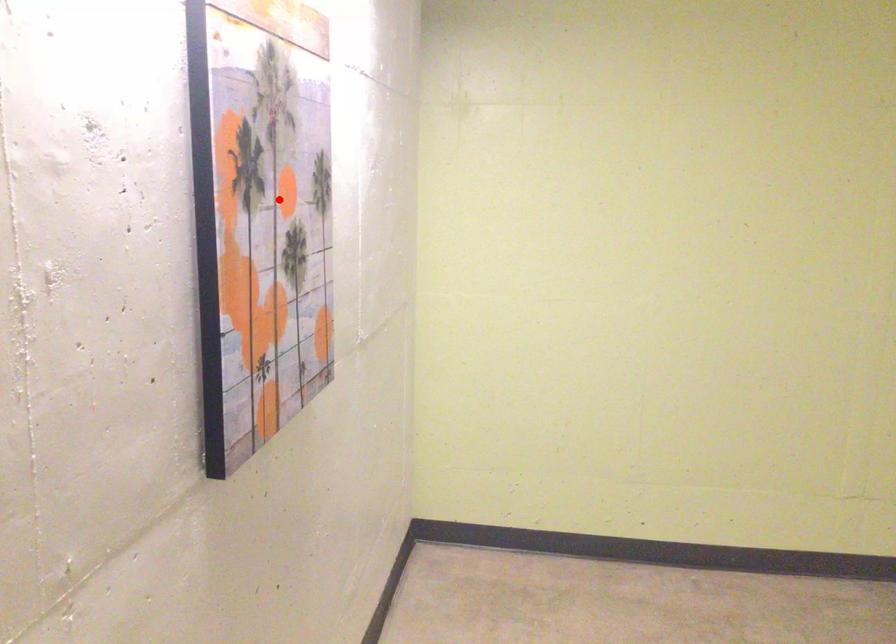
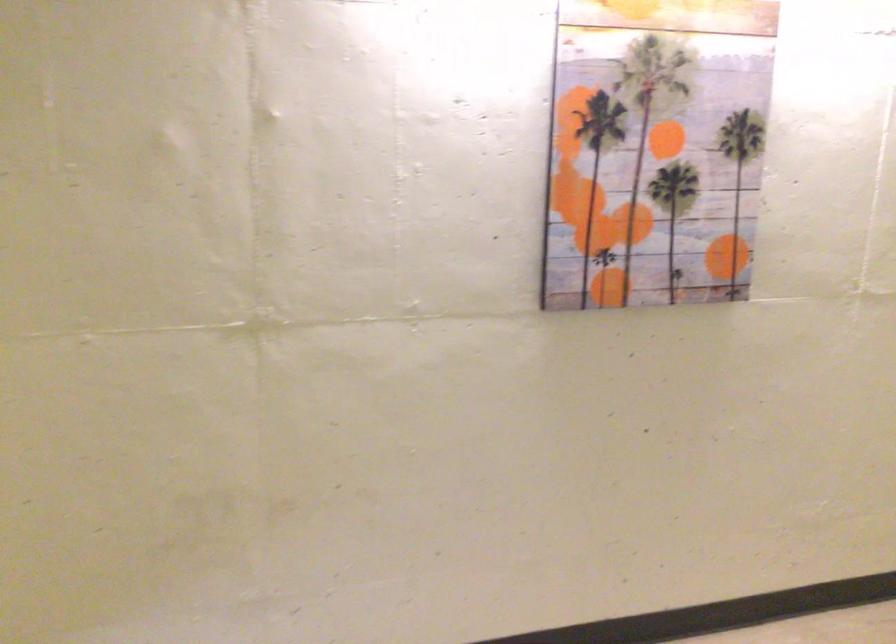
Question: I am providing you with two images of the same scene from different viewpoints. Image1 has a red point marked. In image2, the corresponding 3D location appears at what relative position? Reply with the corresponding letter.

Choices:
 (A) Closer
 (B) Farther

Answer: (B)